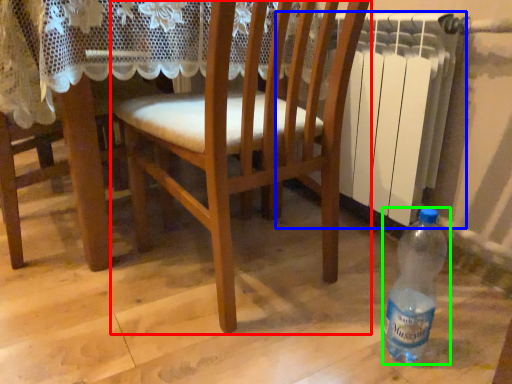
Question: Which object is the closest to the chair (highlighted by a red box)? Choose among these: radiator (highlighted by a blue box) or bottle (highlighted by a green box).

Choices:
 (A) radiator
 (B) bottle

Answer: (A)